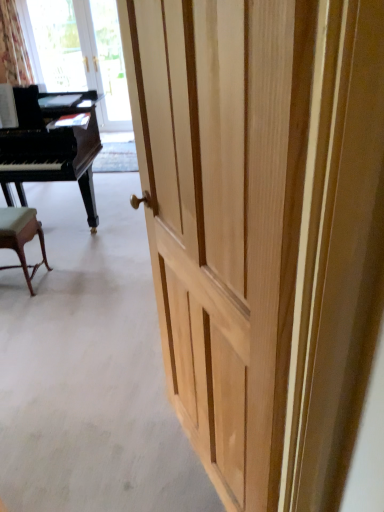
Question: Considering the positions of point (x=8, y=220) and point (x=74, y=68), is point (x=8, y=220) closer or farther from the camera than point (x=74, y=68)?

Choices:
 (A) closer
 (B) farther

Answer: (A)

Question: Is green fabric stool at lower left wider or thinner than transparent glass window screen at upper left?

Choices:
 (A) thin
 (B) wide

Answer: (B)

Question: Considering the real-world distances, which object is farthest from the transparent glass door at upper left?

Choices:
 (A) floral fabric curtain at upper left
 (B) transparent glass window screen at upper left
 (C) green fabric stool at lower left
 (D) black polished piano at left
 (E) natural wood door at center

Answer: (E)

Question: Estimate the real-world distances between objects in this image. Which object is closer to the natural wood door at center?

Choices:
 (A) transparent glass window screen at upper left
 (B) transparent glass door at upper left
 (C) green fabric stool at lower left
 (D) black polished piano at left
 (E) floral fabric curtain at upper left

Answer: (C)